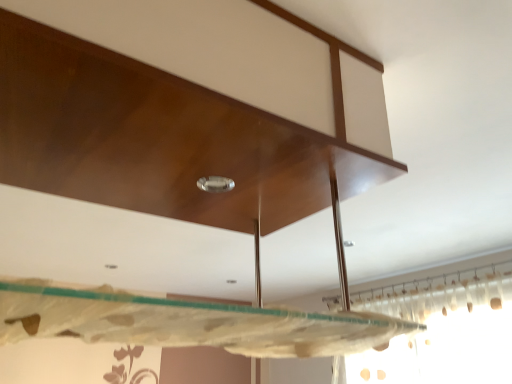
What do you see at coordinates (438, 328) in the screenshot? This screenshot has width=512, height=384. I see `translucent plastic curtain at upper right` at bounding box center [438, 328].

Where is `translucent plastic curtain at upper right`? Image resolution: width=512 pixels, height=384 pixels. translucent plastic curtain at upper right is located at coordinates (438, 328).

In order to face translucent plastic curtain at upper right, should I rotate leftwards or rightwards?

You should rotate right by 20.453 degrees.

Where is `translucent plastic curtain at upper right`? The image size is (512, 384). translucent plastic curtain at upper right is located at coordinates (438, 328).